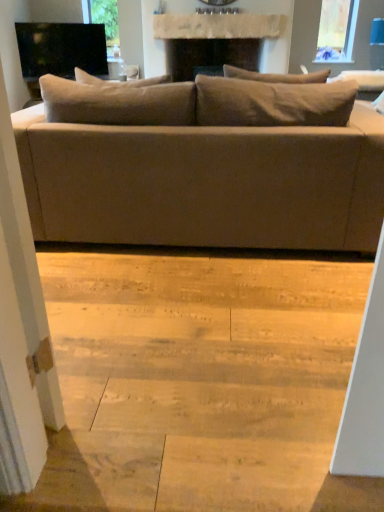
Question: Considering the relative positions of black glossy tv at upper left and matte beige couch at center in the image provided, is black glossy tv at upper left behind matte beige couch at center?

Choices:
 (A) no
 (B) yes

Answer: (B)

Question: Is black glossy tv at upper left surrounding matte beige couch at center?

Choices:
 (A) yes
 (B) no

Answer: (B)

Question: Is black glossy tv at upper left far away from matte beige couch at center?

Choices:
 (A) no
 (B) yes

Answer: (B)

Question: Can you confirm if black glossy tv at upper left is positioned to the right of matte beige couch at center?

Choices:
 (A) yes
 (B) no

Answer: (B)

Question: Can you confirm if black glossy tv at upper left is wider than matte beige couch at center?

Choices:
 (A) no
 (B) yes

Answer: (A)

Question: Considering the positions of matte beige couch at center and black glossy tv at upper left in the image, is matte beige couch at center bigger or smaller than black glossy tv at upper left?

Choices:
 (A) big
 (B) small

Answer: (A)

Question: Would you say matte beige couch at center is inside or outside black glossy tv at upper left?

Choices:
 (A) inside
 (B) outside

Answer: (B)

Question: Is matte beige couch at center taller or shorter than black glossy tv at upper left?

Choices:
 (A) tall
 (B) short

Answer: (A)

Question: From a real-world perspective, is matte beige couch at center physically located above or below black glossy tv at upper left?

Choices:
 (A) above
 (B) below

Answer: (B)

Question: From a real-world perspective, is transparent glass screen door at left physically located above or below natural wood stair at lower center?

Choices:
 (A) above
 (B) below

Answer: (A)

Question: From the image's perspective, is transparent glass screen door at left located above or below natural wood stair at lower center?

Choices:
 (A) below
 (B) above

Answer: (B)

Question: Is transparent glass screen door at left wider or thinner than natural wood stair at lower center?

Choices:
 (A) thin
 (B) wide

Answer: (A)

Question: Is transparent glass screen door at left bigger or smaller than natural wood stair at lower center?

Choices:
 (A) big
 (B) small

Answer: (B)

Question: Is black glossy tv at upper left situated inside matte beige couch at center or outside?

Choices:
 (A) inside
 (B) outside

Answer: (B)

Question: Is point (72, 70) closer or farther from the camera than point (206, 129)?

Choices:
 (A) closer
 (B) farther

Answer: (B)